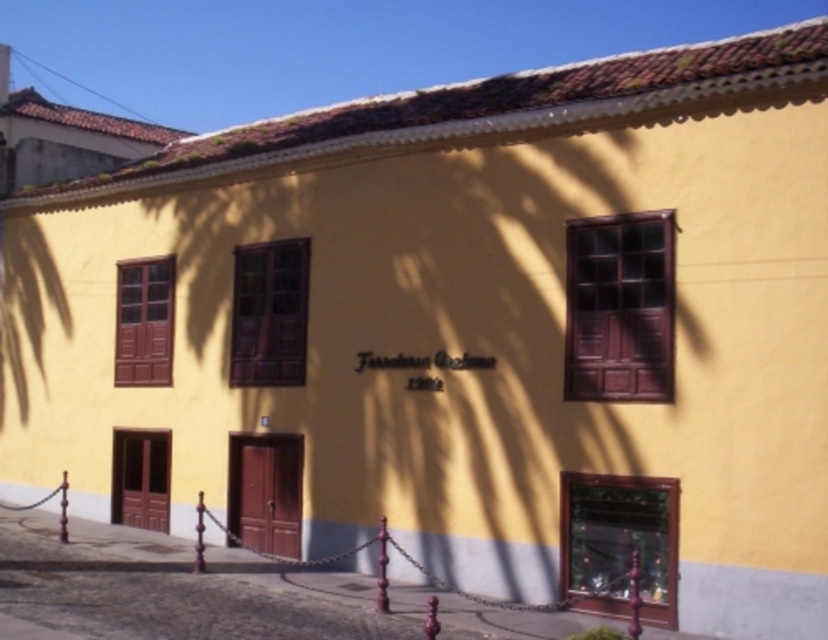
Between brown wooden window at upper center and matte brown wooden window at center, which one is positioned higher?

Positioned higher is brown wooden window at upper center.

Does brown wooden window at upper center come in front of matte brown wooden window at center?

That is True.

Where is `brown wooden window at upper center`? brown wooden window at upper center is located at coordinates (619, 307).

Can you confirm if brown wooden window at upper center is positioned below matte wood window at left?

No, brown wooden window at upper center is not below matte wood window at left.

The image size is (828, 640). What do you see at coordinates (619, 307) in the screenshot?
I see `brown wooden window at upper center` at bounding box center [619, 307].

Is point (634, 248) positioned in front of point (147, 289)?

Yes, it is in front of point (147, 289).

Locate an element on the screen. The width and height of the screenshot is (828, 640). brown wooden window at upper center is located at coordinates (619, 307).

Does matte brown wooden window at center have a greater height compared to matte wood window at left?

In fact, matte brown wooden window at center may be shorter than matte wood window at left.

Which is more to the left, matte brown wooden window at center or matte wood window at left?

Positioned to the left is matte wood window at left.

Is point (301, 317) behind point (123, 339)?

No, it is in front of (123, 339).

I want to click on matte brown wooden window at center, so click(x=268, y=314).